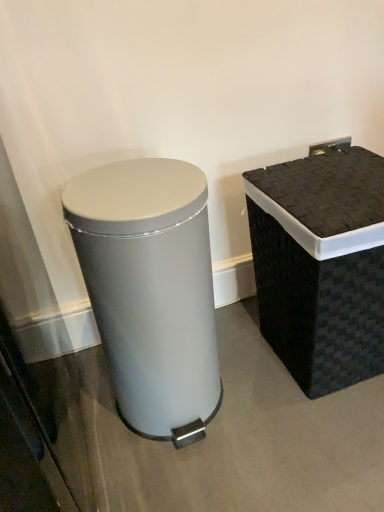
Question: Considering the relative sizes of black woven basket at right, which is counted as the second waste container, starting from the left, and satin silver trash can at left, positioned as the first waste container in left-to-right order, in the image provided, is black woven basket at right, which is counted as the second waste container, starting from the left, shorter than satin silver trash can at left, positioned as the first waste container in left-to-right order,?

Choices:
 (A) yes
 (B) no

Answer: (A)

Question: Can you confirm if black woven basket at right, which is counted as the second waste container, starting from the left, is positioned to the right of satin silver trash can at left, positioned as the first waste container in left-to-right order?

Choices:
 (A) no
 (B) yes

Answer: (B)

Question: Is black woven basket at right, which is counted as the second waste container, starting from the left, beside satin silver trash can at left, marked as the second waste container in a right-to-left arrangement?

Choices:
 (A) no
 (B) yes

Answer: (A)

Question: Considering the relative sizes of black woven basket at right, which is counted as the second waste container, starting from the left, and satin silver trash can at left, positioned as the first waste container in left-to-right order, in the image provided, is black woven basket at right, which is counted as the second waste container, starting from the left, thinner than satin silver trash can at left, positioned as the first waste container in left-to-right order,?

Choices:
 (A) no
 (B) yes

Answer: (A)

Question: Does black woven basket at right, which is counted as the second waste container, starting from the left, appear on the left side of satin silver trash can at left, marked as the second waste container in a right-to-left arrangement?

Choices:
 (A) no
 (B) yes

Answer: (A)

Question: Can you confirm if black woven basket at right, which is counted as the second waste container, starting from the left, is smaller than satin silver trash can at left, positioned as the first waste container in left-to-right order?

Choices:
 (A) yes
 (B) no

Answer: (B)

Question: Considering the relative sizes of satin silver trash can at left, positioned as the first waste container in left-to-right order, and black woven basket at right, which is counted as the second waste container, starting from the left, in the image provided, is satin silver trash can at left, positioned as the first waste container in left-to-right order, thinner than black woven basket at right, which is counted as the second waste container, starting from the left,?

Choices:
 (A) yes
 (B) no

Answer: (A)

Question: Does satin silver trash can at left, positioned as the first waste container in left-to-right order, have a smaller size compared to black woven basket at right, which is counted as the second waste container, starting from the left?

Choices:
 (A) yes
 (B) no

Answer: (A)

Question: Is black woven basket at right, the first waste container viewed from the right, at the back of satin silver trash can at left, marked as the second waste container in a right-to-left arrangement?

Choices:
 (A) yes
 (B) no

Answer: (B)

Question: From a real-world perspective, is satin silver trash can at left, marked as the second waste container in a right-to-left arrangement, beneath black woven basket at right, which is counted as the second waste container, starting from the left?

Choices:
 (A) yes
 (B) no

Answer: (B)

Question: Does satin silver trash can at left, marked as the second waste container in a right-to-left arrangement, appear on the right side of black woven basket at right, the first waste container viewed from the right?

Choices:
 (A) yes
 (B) no

Answer: (B)

Question: Does satin silver trash can at left, marked as the second waste container in a right-to-left arrangement, come in front of black woven basket at right, which is counted as the second waste container, starting from the left?

Choices:
 (A) yes
 (B) no

Answer: (A)

Question: From the image's perspective, is black woven basket at right, which is counted as the second waste container, starting from the left, positioned above or below satin silver trash can at left, marked as the second waste container in a right-to-left arrangement?

Choices:
 (A) above
 (B) below

Answer: (A)